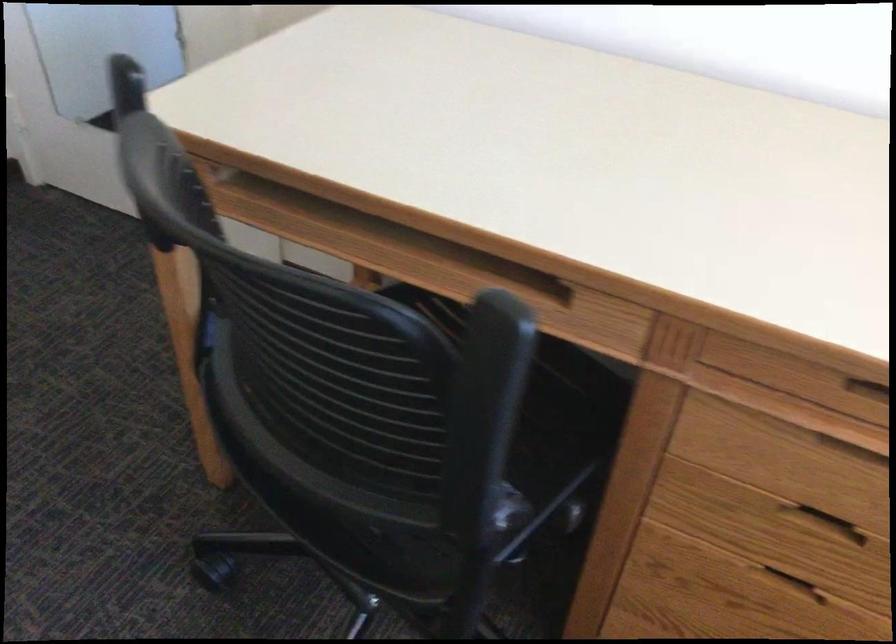
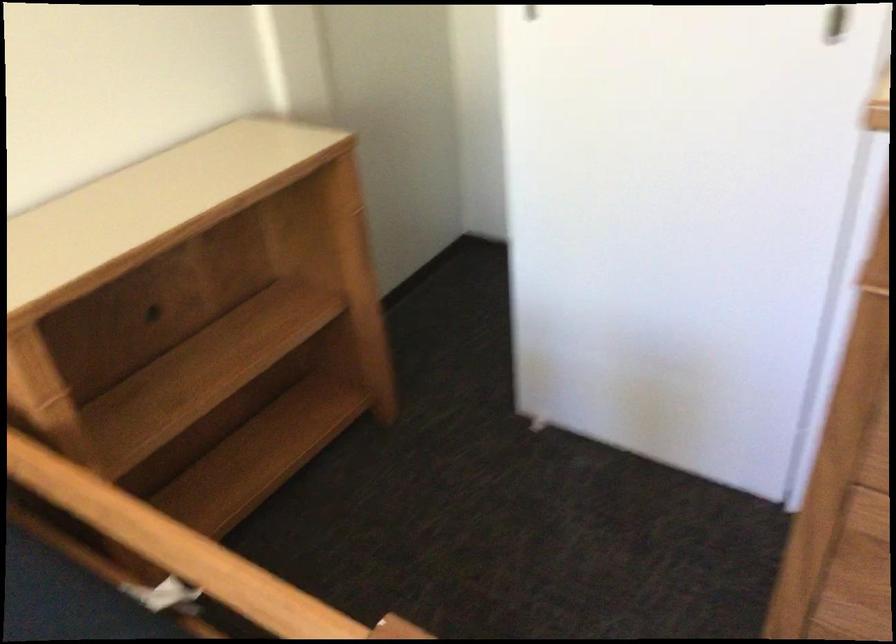
The images are taken continuously from a first-person perspective. In which direction is your viewpoint rotating?

The camera rotated toward left-down.